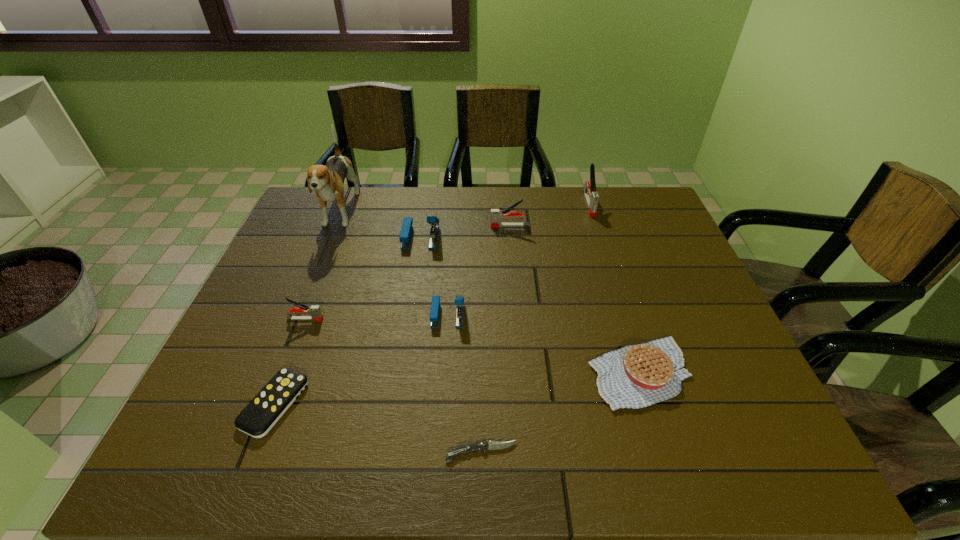
This screenshot has height=540, width=960. Identify the location of vacant space located 0.100m on the handle side of the second stapler from right to left. (459, 226).

This screenshot has width=960, height=540. I want to click on vacant space located on the handle side of the second stapler from right to left, so tap(424, 226).

Locate an element on the screen. The height and width of the screenshot is (540, 960). free point located 0.350m on the left of the sixth object from right to left is located at coordinates (289, 238).

You are a GUI agent. You are given a task and a screenshot of the screen. Output one action in this format:
    pyautogui.click(x=<x>, y=<y>)
    Task: Click on the vacant space located 0.340m on the handle side of the leftmost gray stapler
    
    Given the screenshot: What is the action you would take?
    pyautogui.click(x=459, y=319)

Locate an element on the screen. vacant space located on the front of the smaller blue stapler is located at coordinates (438, 460).

The height and width of the screenshot is (540, 960). Identify the location of vacant region located 0.100m on the right of the brown pie. (734, 373).

What are the coordinates of `blank area located on the right of the eighth tallest object` in the screenshot? It's located at (378, 404).

Where is `vacant space situated 0.190m on the right of the nearest object`? The image size is (960, 540). vacant space situated 0.190m on the right of the nearest object is located at coordinates (615, 453).

This screenshot has height=540, width=960. What are the coordinates of `puppy located at the far edge` in the screenshot? It's located at (328, 180).

This screenshot has height=540, width=960. In order to click on remote control at the near edge in this screenshot , I will do `click(268, 406)`.